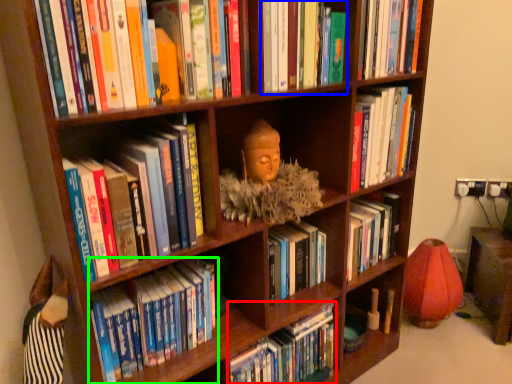
Question: Which object is positioned farthest from book (highlighted by a red box)? Select from book (highlighted by a blue box) and book (highlighted by a green box).

Choices:
 (A) book
 (B) book

Answer: (A)